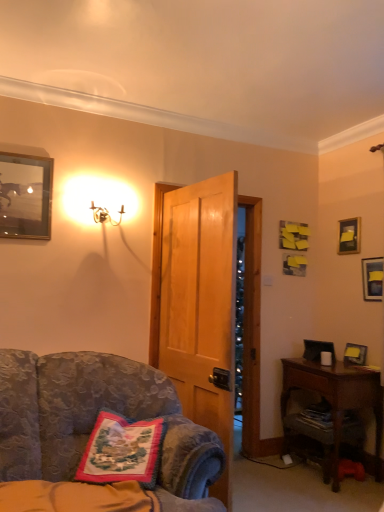
Question: Does point (102, 437) appear closer or farther from the camera than point (327, 355)?

Choices:
 (A) farther
 (B) closer

Answer: (B)

Question: In the image, is embroidered fabric pillow at lower left on the left side or the right side of white matte coffee cup at right?

Choices:
 (A) right
 (B) left

Answer: (B)

Question: Which is farther from the matte black picture frame at upper right, acting as the second picture frame starting from the front?

Choices:
 (A) gold metallic sconce at upper left
 (B) metallic silver picture frame at upper left, the 4th picture frame ordered from the bottom
 (C) white matte coffee cup at right
 (D) wooden picture frame at right, which is counted as the 3th picture frame, starting from the right
 (E) brown wooden desk at lower right

Answer: (B)

Question: Considering the real-world distances, which object is farthest from the velvet floral-patterned chair at center-left?

Choices:
 (A) brown wooden desk at lower right
 (B) embroidered fabric pillow at lower left
 (C) matte black picture frame at upper right, positioned as the 3th picture frame in bottom-to-top order
 (D) white matte coffee cup at right
 (E) metallic silver picture frame at upper left, which ranks as the first picture frame in left-to-right order

Answer: (C)